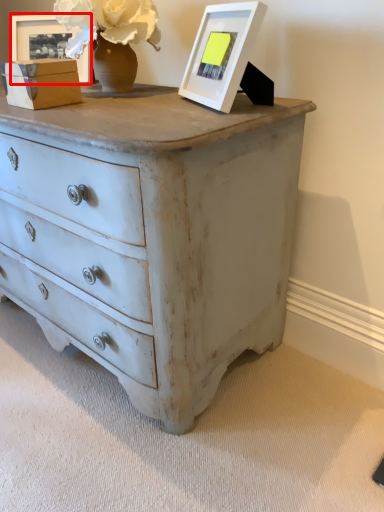
Question: From the image's perspective, what is the correct spatial positioning of picture frame (annotated by the red box) in reference to picture frame?

Choices:
 (A) above
 (B) below

Answer: (A)